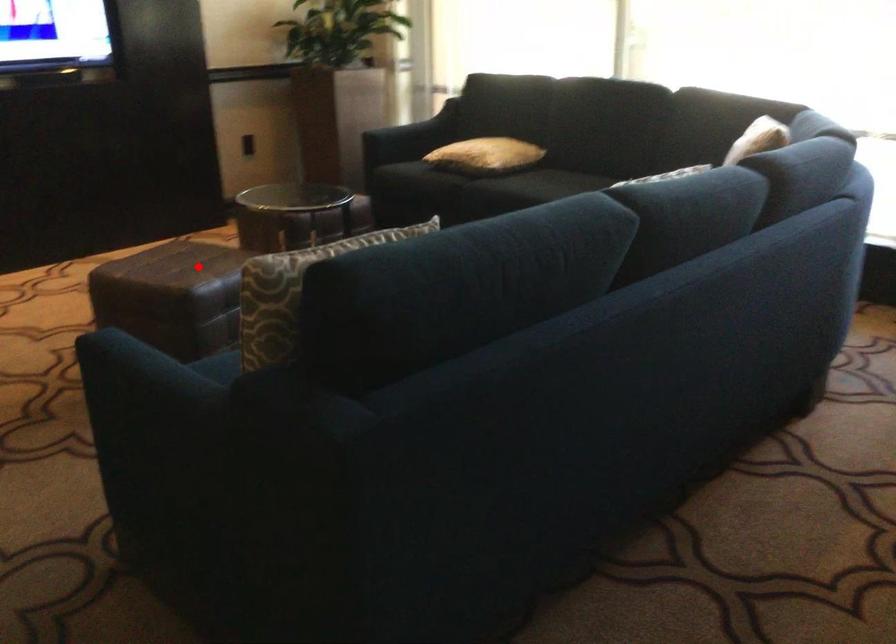
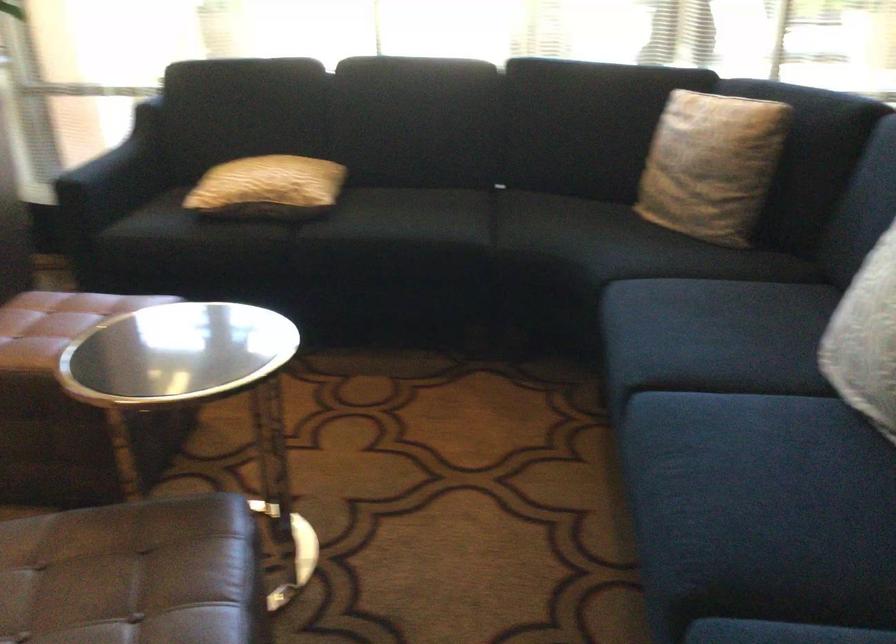
Question: I am providing you with two images of the same scene from different viewpoints. A red point is shown in image1. For the corresponding object point in image2, is it positioned nearer or farther from the camera?

Choices:
 (A) Nearer
 (B) Farther

Answer: (A)